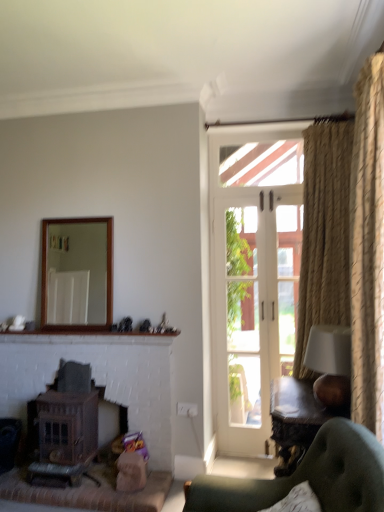
Question: Can you confirm if wooden frame mirror at upper center is thinner than wooden fireplace at lower left, marked as the second fireplace in a right-to-left arrangement?

Choices:
 (A) no
 (B) yes

Answer: (B)

Question: From the image's perspective, is wooden frame mirror at upper center over wooden fireplace at lower left, marked as the second fireplace in a right-to-left arrangement?

Choices:
 (A) no
 (B) yes

Answer: (B)

Question: Is the position of wooden frame mirror at upper center less distant than that of wooden fireplace at lower left, marked as the second fireplace in a right-to-left arrangement?

Choices:
 (A) yes
 (B) no

Answer: (B)

Question: Is wooden frame mirror at upper center not within wooden fireplace at lower left, marked as the second fireplace in a right-to-left arrangement?

Choices:
 (A) no
 (B) yes

Answer: (B)

Question: Does wooden frame mirror at upper center have a smaller size compared to wooden fireplace at lower left, marked as the second fireplace in a right-to-left arrangement?

Choices:
 (A) no
 (B) yes

Answer: (B)

Question: Is wooden frame mirror at upper center wider or thinner than wooden fireplace at lower left, arranged as the 1th fireplace when viewed from the left?

Choices:
 (A) wide
 (B) thin

Answer: (B)

Question: Would you say wooden frame mirror at upper center is inside or outside wooden fireplace at lower left, arranged as the 1th fireplace when viewed from the left?

Choices:
 (A) outside
 (B) inside

Answer: (A)

Question: Based on their sizes in the image, would you say wooden frame mirror at upper center is bigger or smaller than wooden fireplace at lower left, arranged as the 1th fireplace when viewed from the left?

Choices:
 (A) big
 (B) small

Answer: (B)

Question: Visually, is wooden frame mirror at upper center positioned to the left or to the right of wooden fireplace at lower left, marked as the second fireplace in a right-to-left arrangement?

Choices:
 (A) left
 (B) right

Answer: (B)

Question: In terms of size, does wooden fireplace at lower left, the 1th fireplace when ordered from right to left, appear bigger or smaller than green tufted chair at lower right?

Choices:
 (A) small
 (B) big

Answer: (A)

Question: Which is correct: wooden fireplace at lower left, which ranks as the second fireplace in left-to-right order, is inside green tufted chair at lower right, or outside of it?

Choices:
 (A) outside
 (B) inside

Answer: (A)

Question: From a real-world perspective, relative to green tufted chair at lower right, is wooden fireplace at lower left, which ranks as the second fireplace in left-to-right order, vertically above or below?

Choices:
 (A) above
 (B) below

Answer: (B)

Question: Based on their positions, is wooden fireplace at lower left, the 1th fireplace when ordered from right to left, located to the left or right of green tufted chair at lower right?

Choices:
 (A) right
 (B) left

Answer: (B)

Question: From the image's perspective, is green tufted chair at lower right located above or below wooden polished table at lower right?

Choices:
 (A) below
 (B) above

Answer: (B)

Question: Based on their positions, is green tufted chair at lower right located to the left or right of wooden polished table at lower right?

Choices:
 (A) left
 (B) right

Answer: (A)